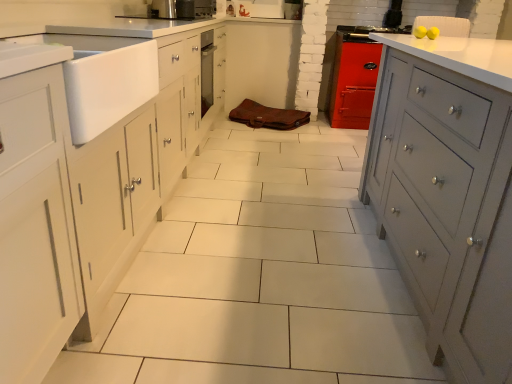
Question: Could you tell me if matte gray cabinet at right is facing white matte sink at left?

Choices:
 (A) yes
 (B) no

Answer: (B)

Question: From the image's perspective, is matte gray cabinet at right beneath white matte sink at left?

Choices:
 (A) yes
 (B) no

Answer: (A)

Question: Is matte gray cabinet at right with white matte sink at left?

Choices:
 (A) no
 (B) yes

Answer: (A)

Question: Considering the relative sizes of matte gray cabinet at right and white matte sink at left in the image provided, is matte gray cabinet at right wider than white matte sink at left?

Choices:
 (A) yes
 (B) no

Answer: (A)

Question: From a real-world perspective, is matte gray cabinet at right beneath white matte sink at left?

Choices:
 (A) no
 (B) yes

Answer: (B)

Question: Considering their positions, is white matte sink at left located in front of or behind metallic stainless steel oven at center?

Choices:
 (A) behind
 (B) front

Answer: (B)

Question: Looking at their shapes, would you say white matte sink at left is wider or thinner than metallic stainless steel oven at center?

Choices:
 (A) wide
 (B) thin

Answer: (A)

Question: Is white matte sink at left to the left or to the right of metallic stainless steel oven at center in the image?

Choices:
 (A) left
 (B) right

Answer: (A)

Question: From a real-world perspective, is white matte sink at left positioned above or below metallic stainless steel oven at center?

Choices:
 (A) above
 (B) below

Answer: (B)

Question: Considering the positions of metallic stainless steel oven at center and white matte sink at left in the image, is metallic stainless steel oven at center wider or thinner than white matte sink at left?

Choices:
 (A) thin
 (B) wide

Answer: (A)

Question: From a real-world perspective, is metallic stainless steel oven at center above or below white matte sink at left?

Choices:
 (A) below
 (B) above

Answer: (B)

Question: Considering their positions, is metallic stainless steel oven at center located in front of or behind white matte sink at left?

Choices:
 (A) behind
 (B) front

Answer: (A)

Question: From the image's perspective, relative to white matte sink at left, is metallic stainless steel oven at center above or below?

Choices:
 (A) above
 (B) below

Answer: (A)

Question: Is matte gray cabinet at right spatially inside metallic stainless steel oven at center, or outside of it?

Choices:
 (A) outside
 (B) inside

Answer: (A)

Question: Is matte gray cabinet at right in front of or behind metallic stainless steel oven at center in the image?

Choices:
 (A) front
 (B) behind

Answer: (A)